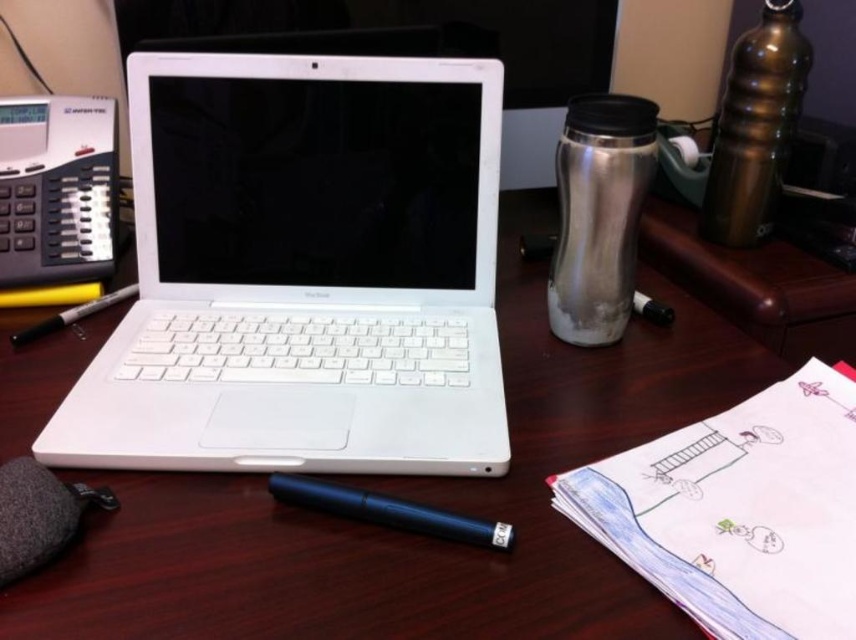
Consider the image. Who is more forward, (x=239, y=172) or (x=366, y=509)?

Point (x=366, y=509) is more forward.

Who is taller, white plastic laptop at center or black plastic pen at lower center?

With more height is white plastic laptop at center.

Is point (395, 353) closer to camera compared to point (330, 508)?

No, (395, 353) is behind (330, 508).

At what (x,y) coordinates should I click in order to perform the action: click on white plastic laptop at center. Please return your answer as a coordinate pair (x, y). The height and width of the screenshot is (640, 856). Looking at the image, I should click on (302, 273).

Describe the element at coordinates (459, 477) in the screenshot. I see `wooden table at center` at that location.

Image resolution: width=856 pixels, height=640 pixels. Identify the location of wooden table at center. (459, 477).

Is point (587, 483) positioned before point (7, 113)?

Yes, point (587, 483) is in front of point (7, 113).

Is point (578, 474) farther from camera compared to point (100, 120)?

No, it is in front of (100, 120).

What are the coordinates of `white paper notepad at lower right` in the screenshot? It's located at (739, 512).